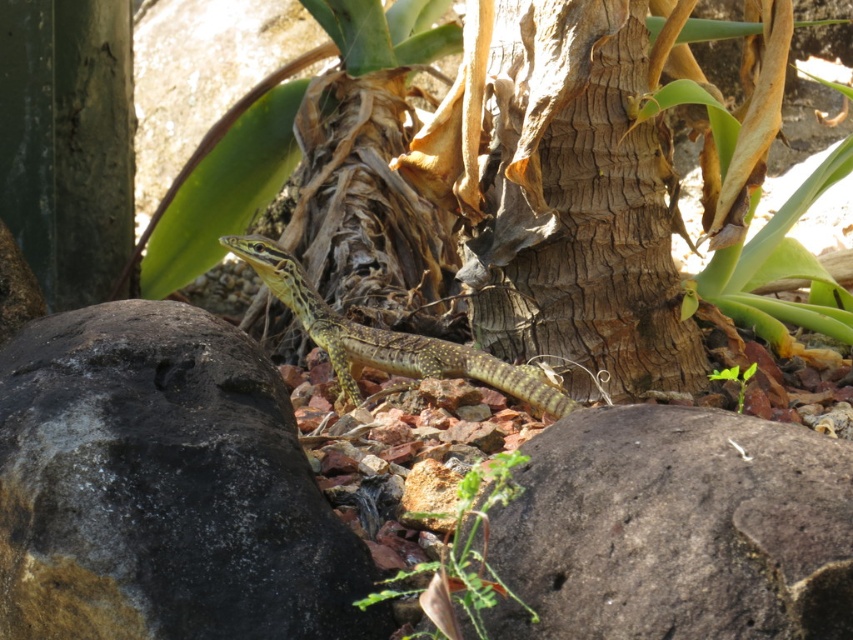
Does dark gray rock at center appear under speckled yellow-green lizard at center?

Yes.

Does dark gray rock at center have a lesser height compared to speckled yellow-green lizard at center?

No.

You are a GUI agent. You are given a task and a screenshot of the screen. Output one action in this format:
    pyautogui.click(x=<x>, y=<y>)
    Task: Click on the dark gray rock at center
    This screenshot has width=853, height=640.
    Given the screenshot: What is the action you would take?
    pyautogui.click(x=163, y=486)

Is rough textured rock at lower right further to the viewer compared to brown rough bark at center?

No.

Is rough textured rock at lower right thinner than brown rough bark at center?

Yes, rough textured rock at lower right is thinner than brown rough bark at center.

Where is `rough textured rock at lower right`? rough textured rock at lower right is located at coordinates (675, 529).

Can you confirm if dark gray rock at center is smaller than green leafy plant at center?

No.

Can you confirm if dark gray rock at center is thinner than green leafy plant at center?

Incorrect, dark gray rock at center's width is not less than green leafy plant at center's.

Between point (134, 300) and point (737, 397), which one is positioned behind?

Positioned behind is point (737, 397).

Image resolution: width=853 pixels, height=640 pixels. I want to click on dark gray rock at center, so click(x=163, y=486).